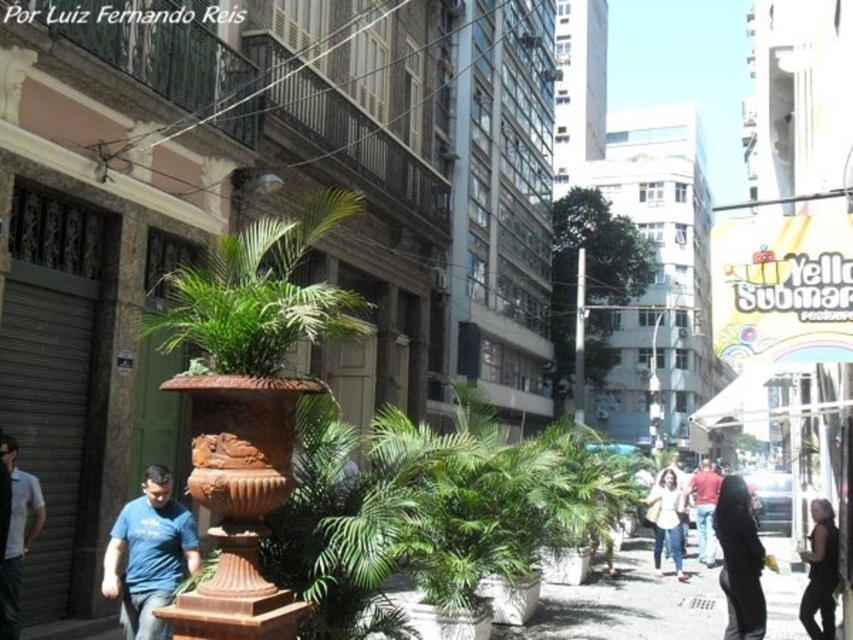
You are a fashion designer observing the urban street scene. You notice a black leather jacket at lower right and a matte red shirt at center. Which clothing item appears to be thinner in the image?

The black leather jacket at lower right is thinner than the matte red shirt at center.

You are a delivery person standing in the middle of the street. You need to place the dark gray fabric jacket at lower right into a storage box. The storage box can only hold items smaller than the brown terracotta pot at center. Will the jacket fit?

The brown terracotta pot at center has a larger size compared to dark gray fabric jacket at lower right. Since the storage box can only hold items smaller than the pot, the dark gray fabric jacket at lower right will fit as it is smaller.